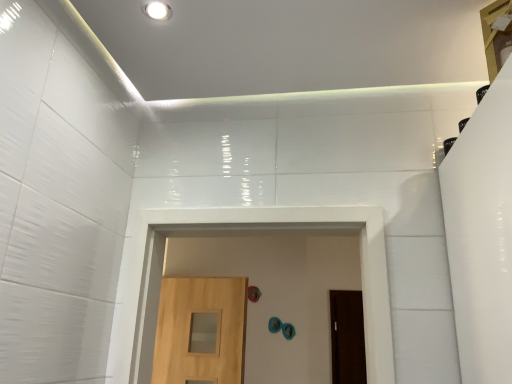
Image resolution: width=512 pixels, height=384 pixels. Describe the element at coordinates (201, 330) in the screenshot. I see `light brown wood door at center, the first door from the front` at that location.

Where is `light brown wood door at center, positioned as the 2th door in right-to-left order`? This screenshot has height=384, width=512. light brown wood door at center, positioned as the 2th door in right-to-left order is located at coordinates (201, 330).

Choose the correct answer: Is white glossy recessed light at upper center inside brown matte door at center, the first door in the right-to-left sequence, or outside it?

white glossy recessed light at upper center lies outside brown matte door at center, the first door in the right-to-left sequence.

Locate an element on the screen. The width and height of the screenshot is (512, 384). the 2nd door located beneath the white glossy recessed light at upper center (from a real-world perspective) is located at coordinates (347, 337).

Does white glossy recessed light at upper center have a lesser height compared to brown matte door at center, the second door viewed from the left?

Indeed, white glossy recessed light at upper center has a lesser height compared to brown matte door at center, the second door viewed from the left.

Does point (170, 10) come behind point (362, 350)?

No, (170, 10) is in front of (362, 350).

From a real-world perspective, is light brown wood door at center, positioned as the 2th door in right-to-left order, located higher than white glossy recessed light at upper center?

No, from a real-world perspective, light brown wood door at center, positioned as the 2th door in right-to-left order, is not over white glossy recessed light at upper center

Between light brown wood door at center, the first door from the front, and white glossy recessed light at upper center, which one is positioned behind?

light brown wood door at center, the first door from the front.

Is light brown wood door at center, positioned as the 2th door in right-to-left order, looking in the opposite direction of white glossy recessed light at upper center?

No, light brown wood door at center, positioned as the 2th door in right-to-left order, is not facing the opposite direction of white glossy recessed light at upper center.

Considering the sizes of objects brown matte door at center, acting as the 1th door starting from the back, and light brown wood door at center, arranged as the second door when viewed from the back, in the image provided, who is thinner, brown matte door at center, acting as the 1th door starting from the back, or light brown wood door at center, arranged as the second door when viewed from the back,?

With smaller width is brown matte door at center, acting as the 1th door starting from the back.

From a real-world perspective, which is physically above, brown matte door at center, the first door in the right-to-left sequence, or light brown wood door at center, positioned as the 2th door in right-to-left order?

light brown wood door at center, positioned as the 2th door in right-to-left order.

In terms of size, does light brown wood door at center, the first door from the front, appear bigger or smaller than brown matte door at center, acting as the 1th door starting from the back?

In the image, light brown wood door at center, the first door from the front, appears to be larger than brown matte door at center, acting as the 1th door starting from the back.

From the image's perspective, is light brown wood door at center, arranged as the second door when viewed from the back, below brown matte door at center, the 2th door in the front-to-back sequence?

No, from the image's perspective, light brown wood door at center, arranged as the second door when viewed from the back, is not beneath brown matte door at center, the 2th door in the front-to-back sequence.

In terms of height, does light brown wood door at center, placed as the first door when sorted from left to right, look taller or shorter compared to brown matte door at center, the 2th door in the front-to-back sequence?

In the image, light brown wood door at center, placed as the first door when sorted from left to right, appears to be shorter than brown matte door at center, the 2th door in the front-to-back sequence.

Considering the relative positions of light brown wood door at center, the first door from the front, and brown matte door at center, the first door in the right-to-left sequence, in the image provided, is light brown wood door at center, the first door from the front, to the left or to the right of brown matte door at center, the first door in the right-to-left sequence,?

light brown wood door at center, the first door from the front, is to the left of brown matte door at center, the first door in the right-to-left sequence.

From their relative heights in the image, would you say brown matte door at center, the first door in the right-to-left sequence, is taller or shorter than white glossy recessed light at upper center?

Clearly, brown matte door at center, the first door in the right-to-left sequence, is taller compared to white glossy recessed light at upper center.

From the image's perspective, is brown matte door at center, acting as the 1th door starting from the back, located beneath white glossy recessed light at upper center?

Yes.

Considering the relative sizes of brown matte door at center, the second door viewed from the left, and white glossy recessed light at upper center in the image provided, is brown matte door at center, the second door viewed from the left, smaller than white glossy recessed light at upper center?

No, brown matte door at center, the second door viewed from the left, is not smaller than white glossy recessed light at upper center.

Would you say white glossy recessed light at upper center is outside light brown wood door at center, placed as the first door when sorted from left to right?

Yes, white glossy recessed light at upper center is not within light brown wood door at center, placed as the first door when sorted from left to right.

From a real-world perspective, which object stands above the other?

white glossy recessed light at upper center is physically above.

Is white glossy recessed light at upper center beside light brown wood door at center, the first door from the front?

No.

At what (x,y) coordinates should I click in order to perform the action: click on lighting above the brown matte door at center, the 2th door in the front-to-back sequence (from a real-world perspective). Please return your answer as a coordinate pair (x, y). Looking at the image, I should click on (x=157, y=10).

You are a GUI agent. You are given a task and a screenshot of the screen. Output one action in this format:
    pyautogui.click(x=<x>, y=<y>)
    Task: Click on the lighting lying in front of the light brown wood door at center, positioned as the 2th door in right-to-left order
    
    Given the screenshot: What is the action you would take?
    pyautogui.click(x=157, y=10)

Considering their positions, is brown matte door at center, the 2th door in the front-to-back sequence, positioned closer to white glossy recessed light at upper center than light brown wood door at center, positioned as the 2th door in right-to-left order?

The object closer to white glossy recessed light at upper center is light brown wood door at center, positioned as the 2th door in right-to-left order.

Estimate the real-world distances between objects in this image. Which object is closer to brown matte door at center, acting as the 1th door starting from the back, light brown wood door at center, arranged as the second door when viewed from the back, or white glossy recessed light at upper center?

Among the two, light brown wood door at center, arranged as the second door when viewed from the back, is located nearer to brown matte door at center, acting as the 1th door starting from the back.

Which object lies nearer to the anchor point brown matte door at center, acting as the 1th door starting from the back, white glossy recessed light at upper center or light brown wood door at center, arranged as the second door when viewed from the back?

light brown wood door at center, arranged as the second door when viewed from the back, is positioned closer to the anchor brown matte door at center, acting as the 1th door starting from the back.

Estimate the real-world distances between objects in this image. Which object is further from light brown wood door at center, positioned as the 2th door in right-to-left order, brown matte door at center, the first door in the right-to-left sequence, or white glossy recessed light at upper center?

white glossy recessed light at upper center.

Looking at the image, which one is located closer to light brown wood door at center, positioned as the 2th door in right-to-left order, white glossy recessed light at upper center or brown matte door at center, acting as the 1th door starting from the back?

Based on the image, brown matte door at center, acting as the 1th door starting from the back, appears to be nearer to light brown wood door at center, positioned as the 2th door in right-to-left order.

Based on their spatial positions, is light brown wood door at center, arranged as the second door when viewed from the back, or brown matte door at center, the first door in the right-to-left sequence, further from white glossy recessed light at upper center?

brown matte door at center, the first door in the right-to-left sequence, is further to white glossy recessed light at upper center.

At what (x,y) coordinates should I click in order to perform the action: click on door positioned between white glossy recessed light at upper center and brown matte door at center, the 2th door in the front-to-back sequence, from near to far. Please return your answer as a coordinate pair (x, y). Looking at the image, I should click on (201, 330).